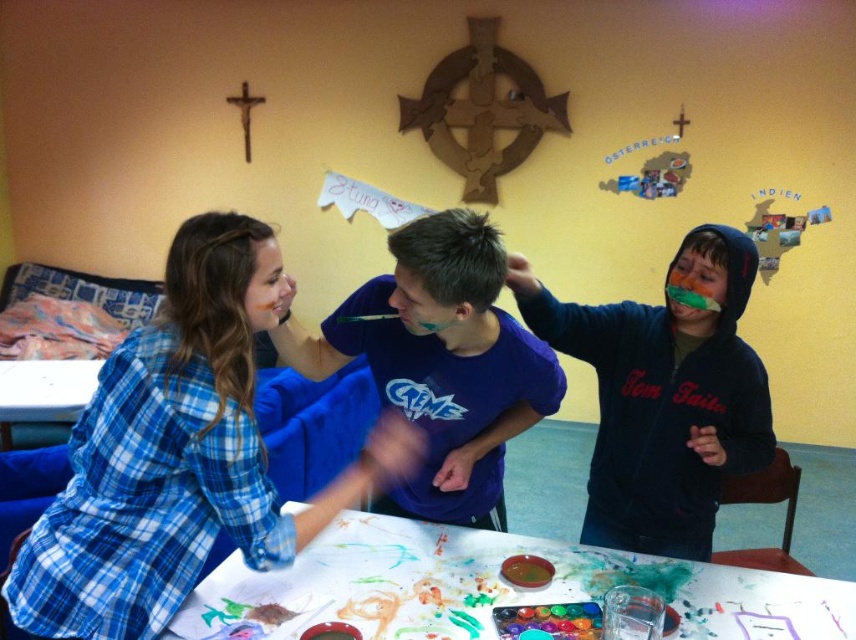
Find the location of a particular element. blue plaid shirt at upper left is located at coordinates (180, 454).

Can you confirm if blue plaid shirt at upper left is wider than white paper at center?

No, blue plaid shirt at upper left is not wider than white paper at center.

The height and width of the screenshot is (640, 856). What are the coordinates of `blue plaid shirt at upper left` in the screenshot? It's located at (180, 454).

From the picture: Is dark blue hoodie at center shorter than white paper at center?

No, dark blue hoodie at center is not shorter than white paper at center.

Is dark blue hoodie at center below white paper at center?

Actually, dark blue hoodie at center is above white paper at center.

Is point (620, 500) closer to camera compared to point (803, 579)?

No, (620, 500) is further to viewer.

The width and height of the screenshot is (856, 640). In order to click on dark blue hoodie at center in this screenshot , I will do `click(664, 396)`.

Does blue plaid shirt at upper left come behind dark blue hoodie at center?

No, it is not.

Between blue plaid shirt at upper left and dark blue hoodie at center, which one appears on the left side from the viewer's perspective?

From the viewer's perspective, blue plaid shirt at upper left appears more on the left side.

Find the location of a particular element. Image resolution: width=856 pixels, height=640 pixels. blue plaid shirt at upper left is located at coordinates (180, 454).

You are a GUI agent. You are given a task and a screenshot of the screen. Output one action in this format:
    pyautogui.click(x=<x>, y=<y>)
    Task: Click on the blue plaid shirt at upper left
    
    Given the screenshot: What is the action you would take?
    pyautogui.click(x=180, y=454)